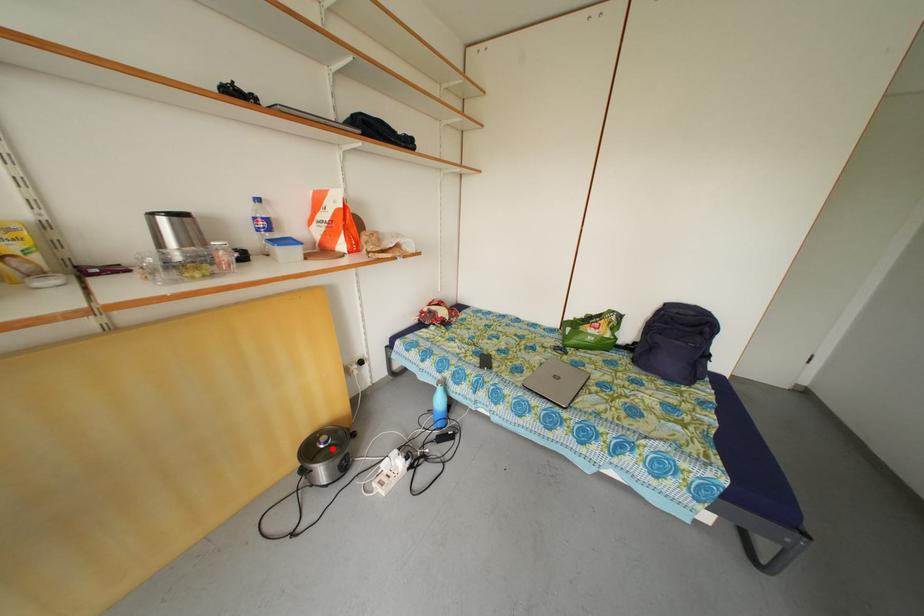
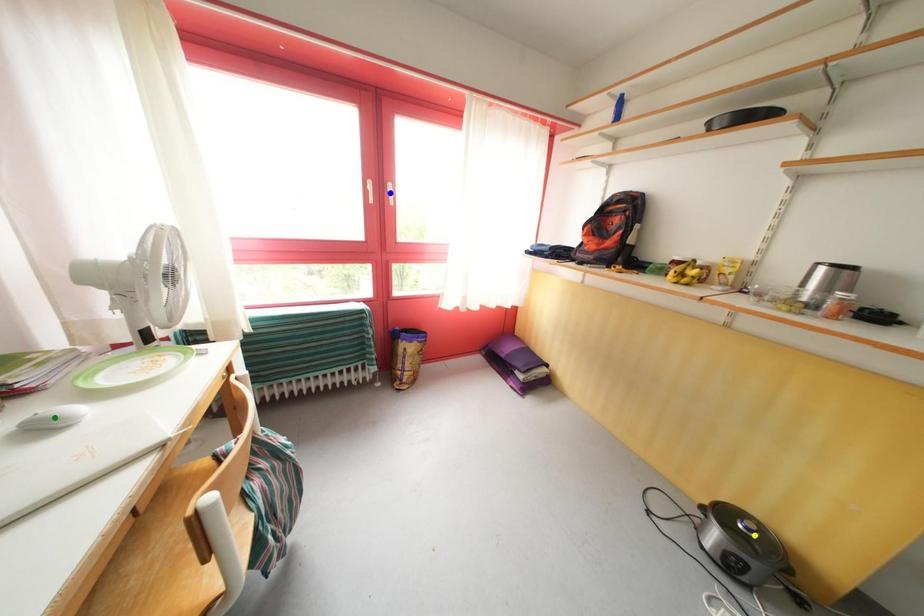
Question: I am providing you with two images of the same scene from different viewpoints. A red point is marked on the first image. You are given multiple points on the second image. Which mark in image 2 goes with the point in image 1?

Choices:
 (A) blue point
 (B) green point
 (C) yellow point

Answer: (C)